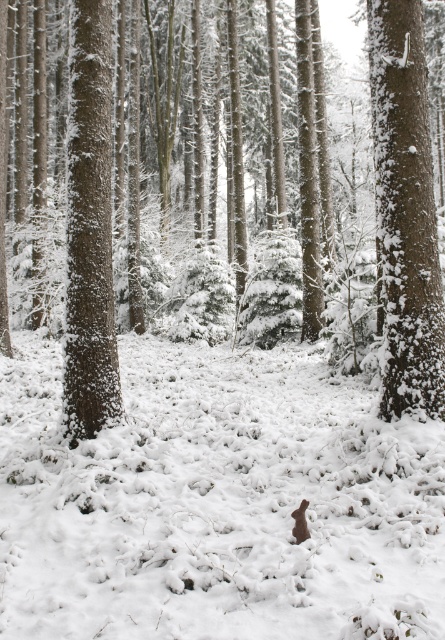
Is snow-covered bark tree at upper right taller than brown furry rabbit at center?

Indeed, snow-covered bark tree at upper right has a greater height compared to brown furry rabbit at center.

Between snow-covered bark tree at upper right and brown furry rabbit at center, which one has less height?

With less height is brown furry rabbit at center.

Where is `snow-covered bark tree at upper right`? This screenshot has height=640, width=445. snow-covered bark tree at upper right is located at coordinates (404, 211).

Identify the location of snow-covered bark tree at upper right. (404, 211).

Can you confirm if white fluffy snow at center is positioned to the right of brown furry rabbit at center?

In fact, white fluffy snow at center is to the left of brown furry rabbit at center.

Can you confirm if white fluffy snow at center is wider than brown furry rabbit at center?

Yes.

What do you see at coordinates (217, 500) in the screenshot?
I see `white fluffy snow at center` at bounding box center [217, 500].

Locate an element on the screen. Image resolution: width=445 pixels, height=640 pixels. white fluffy snow at center is located at coordinates (217, 500).

Does white fluffy snow at center have a larger size compared to snow-covered bark tree at upper right?

Indeed, white fluffy snow at center has a larger size compared to snow-covered bark tree at upper right.

Can you confirm if white fluffy snow at center is positioned below snow-covered bark tree at upper right?

Yes.

Find the location of `white fluffy snow at center`. white fluffy snow at center is located at coordinates (217, 500).